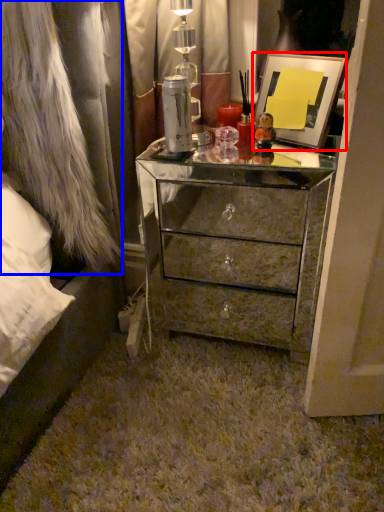
Question: Which object appears farthest to the camera in this image, picture frame (highlighted by a red box) or fur coat (highlighted by a blue box)?

Choices:
 (A) picture frame
 (B) fur coat

Answer: (A)